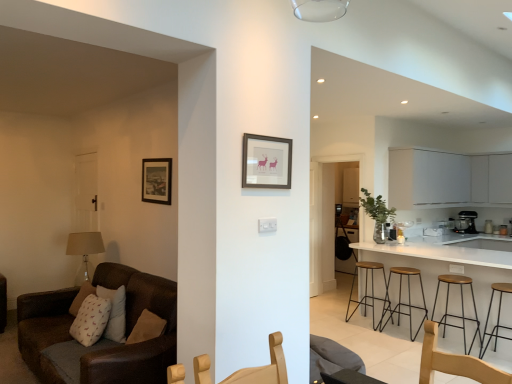
What do you see at coordinates (469, 220) in the screenshot? The image size is (512, 384). I see `metallic silver blender at right` at bounding box center [469, 220].

You are a GUI agent. You are given a task and a screenshot of the screen. Output one action in this format:
    pyautogui.click(x=<x>, y=<y>)
    Task: Click on the metallic silver blender at right
    This screenshot has height=384, width=512.
    Given the screenshot: What is the action you would take?
    pyautogui.click(x=469, y=220)

Image resolution: width=512 pixels, height=384 pixels. What do you see at coordinates (461, 307) in the screenshot?
I see `wooden seat stool at right, which is the third stool in back-to-front order` at bounding box center [461, 307].

In order to face matte black picture frame at upper center, arranged as the first picture frame when viewed from the left, should I rotate leftwards or rightwards?

You should rotate left by 13.308 degrees.

What is the approximate width of matte black picture frame at upper center, the 2th picture frame from the right?

0.83 inches.

What do you see at coordinates (366, 290) in the screenshot?
I see `wooden stool at right, arranged as the 4th stool when viewed from the front` at bounding box center [366, 290].

In order to face brown leather couch at left, should I rotate leftwards or rightwards?

Turn left approximately 19.169 degrees to face it.

What is the approximate height of matte brown picture frame at center, which is the 2th picture frame from left to right?

matte brown picture frame at center, which is the 2th picture frame from left to right, is 12.95 inches in height.

Where is `matte brown picture frame at center, the 2th picture frame viewed from the back`? This screenshot has height=384, width=512. matte brown picture frame at center, the 2th picture frame viewed from the back is located at coordinates (266, 162).

At what (x,y) coordinates should I click in order to perform the action: click on metallic silver blender at right. Please return your answer as a coordinate pair (x, y). The image size is (512, 384). Looking at the image, I should click on (x=469, y=220).

Considering the positions of point (288, 153) and point (499, 288), is point (288, 153) closer or farther from the camera than point (499, 288)?

Point (288, 153) appears to be closer to the viewer than point (499, 288).

From the image's perspective, is matte brown picture frame at center, which is the 2th picture frame from left to right, below wooden stool at lower right, placed as the fourth stool when sorted from back to front?

No.

From a real-world perspective, which is physically above, matte brown picture frame at center, which is the 2th picture frame from left to right, or wooden stool at lower right, placed as the fourth stool when sorted from back to front?

matte brown picture frame at center, which is the 2th picture frame from left to right.

Where is `picture frame that is the 2nd one above the wooden stool at lower right, placed as the fourth stool when sorted from back to front (from a real-world perspective)`? The height and width of the screenshot is (384, 512). picture frame that is the 2nd one above the wooden stool at lower right, placed as the fourth stool when sorted from back to front (from a real-world perspective) is located at coordinates point(266,162).

Identify the location of the 4th stool positioned below the brown leather couch at left (from the image's perspective). This screenshot has width=512, height=384. (497, 316).

Is brown leather couch at left oriented away from wooden stool at lower right, the 1th stool in the front-to-back sequence?

That's right, brown leather couch at left is facing away from wooden stool at lower right, the 1th stool in the front-to-back sequence.

Which is less distant, (x=59, y=334) or (x=496, y=333)?

Point (x=59, y=334).

Can you confirm if brown leather couch at left is bigger than wooden stool at lower right, the 1th stool in the front-to-back sequence?

Yes, brown leather couch at left is bigger than wooden stool at lower right, the 1th stool in the front-to-back sequence.

Is wooden stool at lower right, placed as the fourth stool when sorted from back to front, next to wooden stool at right, which is the first stool in back-to-front order?

wooden stool at lower right, placed as the fourth stool when sorted from back to front, and wooden stool at right, which is the first stool in back-to-front order, are not in contact.

Does wooden stool at lower right, placed as the fourth stool when sorted from back to front, have a larger size compared to wooden stool at right, which is the first stool in back-to-front order?

No.

Is wooden stool at lower right, placed as the fourth stool when sorted from back to front, located outside wooden stool at right, which is the first stool in back-to-front order?

Yes, wooden stool at lower right, placed as the fourth stool when sorted from back to front, is not within wooden stool at right, which is the first stool in back-to-front order.

How far apart are wooden stool at lower right, placed as the fourth stool when sorted from back to front, and wooden stool at right, arranged as the 4th stool when viewed from the front?

wooden stool at lower right, placed as the fourth stool when sorted from back to front, is 3.92 feet away from wooden stool at right, arranged as the 4th stool when viewed from the front.

Is white matte cabinet at upper right wider than wooden stool at lower right, the 1th stool in the front-to-back sequence?

Indeed, white matte cabinet at upper right has a greater width compared to wooden stool at lower right, the 1th stool in the front-to-back sequence.

Is wooden stool at lower right, placed as the fourth stool when sorted from back to front, a part of white matte cabinet at upper right?

No, white matte cabinet at upper right does not contain wooden stool at lower right, placed as the fourth stool when sorted from back to front.

Which is nearer, (451, 171) or (485, 349)?

The point (485, 349) is in front.

From the image's perspective, is white matte cabinet at upper right below wooden stool at lower right, placed as the fourth stool when sorted from back to front?

No, from the image's perspective, white matte cabinet at upper right is not below wooden stool at lower right, placed as the fourth stool when sorted from back to front.

Does point (461, 318) come in front of point (385, 278)?

Yes, point (461, 318) is closer to viewer.

Could you tell me if wooden seat stool at right, which is the third stool in back-to-front order, is turned towards wooden stool at right, which is the first stool in back-to-front order?

No.

This screenshot has width=512, height=384. I want to click on the 2nd stool in front of the wooden stool at right, which is the first stool in back-to-front order, counting from the anchor's position, so click(x=461, y=307).

From the image's perspective, who appears lower, wooden seat stool at right, the second stool in the front-to-back sequence, or wooden stool at right, which is the first stool in back-to-front order?

From the image's view, wooden seat stool at right, the second stool in the front-to-back sequence, is below.

From the image's perspective, which is above, wooden stool at lower right, the 1th stool in the front-to-back sequence, or white glossy counter top at right?

white glossy counter top at right.

From a real-world perspective, between wooden stool at lower right, the 1th stool in the front-to-back sequence, and white glossy counter top at right, who is vertically higher?

In real-world perspective, white glossy counter top at right is above.

Between wooden stool at lower right, the 1th stool in the front-to-back sequence, and white glossy counter top at right, which one has less height?

wooden stool at lower right, the 1th stool in the front-to-back sequence, is shorter.

How far apart are wooden stool at lower right, placed as the fourth stool when sorted from back to front, and white glossy counter top at right?

The distance of wooden stool at lower right, placed as the fourth stool when sorted from back to front, from white glossy counter top at right is 17.64 inches.

Do you think light wood chair at center is within matte black picture frame at upper center, which is the 1th picture frame in back-to-front order, or outside of it?

light wood chair at center cannot be found inside matte black picture frame at upper center, which is the 1th picture frame in back-to-front order.

Is light wood chair at center positioned far away from matte black picture frame at upper center, which is the 1th picture frame in back-to-front order?

light wood chair at center is positioned a significant distance from matte black picture frame at upper center, which is the 1th picture frame in back-to-front order.

Considering the sizes of objects light wood chair at center and matte black picture frame at upper center, the 2th picture frame from the right, in the image provided, who is smaller, light wood chair at center or matte black picture frame at upper center, the 2th picture frame from the right,?

matte black picture frame at upper center, the 2th picture frame from the right, is smaller.

From a real-world perspective, is light wood chair at center positioned under matte black picture frame at upper center, arranged as the first picture frame when viewed from the left, based on gravity?

Yes, from a real-world perspective, light wood chair at center is beneath matte black picture frame at upper center, arranged as the first picture frame when viewed from the left.

I want to click on the 1st stool behind the matte brown picture frame at center, the 2th picture frame viewed from the back, so click(497, 316).

Identify the location of studio couch located in front of the wooden stool at lower right, the 1th stool in the front-to-back sequence. The width and height of the screenshot is (512, 384). (132, 328).

When comparing their distances from wooden seat stool at right, which is the third stool in back-to-front order, does wooden stool at right, arranged as the 4th stool when viewed from the front, or white glossy counter top at right seem closer?

Based on the image, white glossy counter top at right appears to be nearer to wooden seat stool at right, which is the third stool in back-to-front order.

When comparing their distances from wooden seat at right, placed as the third stool when sorted from front to back, does brown leather couch at left or wooden seat stool at right, the second stool in the front-to-back sequence, seem further?

brown leather couch at left is positioned further to the anchor wooden seat at right, placed as the third stool when sorted from front to back.

When comparing their distances from matte brown picture frame at center, which is counted as the 1th picture frame, starting from the front, does wooden stool at right, which is the first stool in back-to-front order, or wooden stool at lower right, the 1th stool in the front-to-back sequence, seem closer?

wooden stool at lower right, the 1th stool in the front-to-back sequence, lies closer to matte brown picture frame at center, which is counted as the 1th picture frame, starting from the front, than the other object.

Looking at the image, which one is located further to matte brown picture frame at center, which is counted as the 1th picture frame, starting from the front, wooden seat at right, placed as the third stool when sorted from front to back, or light wood chair at center?

Among the two, wooden seat at right, placed as the third stool when sorted from front to back, is located further to matte brown picture frame at center, which is counted as the 1th picture frame, starting from the front.

Considering their positions, is brown leather couch at left positioned closer to transparent glass door at center than wooden stool at lower right, placed as the fourth stool when sorted from back to front?

The object closer to transparent glass door at center is wooden stool at lower right, placed as the fourth stool when sorted from back to front.

Which object lies nearer to the anchor point light wood chair at center, matte black picture frame at upper center, which is the 1th picture frame in back-to-front order, or white matte cabinet at upper right?

Based on the image, matte black picture frame at upper center, which is the 1th picture frame in back-to-front order, appears to be nearer to light wood chair at center.

Based on their spatial positions, is white glossy counter top at right or matte brown picture frame at center, which is the 2th picture frame from left to right, closer to wooden seat at right, placed as the third stool when sorted from front to back?

white glossy counter top at right is positioned closer to the anchor wooden seat at right, placed as the third stool when sorted from front to back.

Looking at the image, which one is located further to wooden seat stool at right, the second stool in the front-to-back sequence, transparent glass door at center or wooden stool at lower right, the 1th stool in the front-to-back sequence?

The object further to wooden seat stool at right, the second stool in the front-to-back sequence, is transparent glass door at center.

Locate an element on the screen. glass door between matte black picture frame at upper center, which is the 1th picture frame in back-to-front order, and wooden seat stool at right, which is the third stool in back-to-front order is located at coordinates (330, 216).

The image size is (512, 384). What are the coordinates of `glass door between wooden stool at lower right, the 1th stool in the front-to-back sequence, and metallic silver blender at right, along the z-axis` in the screenshot? It's located at (330, 216).

You are a GUI agent. You are given a task and a screenshot of the screen. Output one action in this format:
    pyautogui.click(x=<x>, y=<y>)
    Task: Click on the counter top between white matte cabinet at upper right and wooden stool at lower right, the 1th stool in the front-to-back sequence, vertically
    
    Given the screenshot: What is the action you would take?
    pyautogui.click(x=449, y=261)

Locate an element on the screen. Image resolution: width=512 pixels, height=384 pixels. counter top between white matte cabinet at upper right and wooden seat at right, the second stool viewed from the back, vertically is located at coordinates (449, 261).